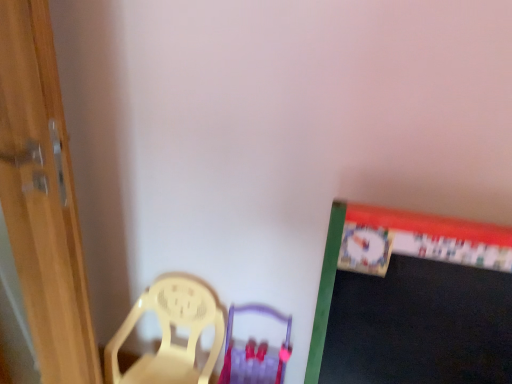
Question: From a real-world perspective, relative to wooden door at left, is purple plastic armchair at center vertically above or below?

Choices:
 (A) below
 (B) above

Answer: (A)

Question: Do you think purple plastic armchair at center is within wooden door at left, or outside of it?

Choices:
 (A) inside
 (B) outside

Answer: (B)

Question: Estimate the real-world distances between objects in this image. Which object is farther from the yellow plastic chair at lower left?

Choices:
 (A) purple plastic armchair at center
 (B) wooden door at left

Answer: (B)

Question: Which is nearer to the yellow plastic chair at lower left?

Choices:
 (A) wooden door at left
 (B) purple plastic armchair at center

Answer: (B)